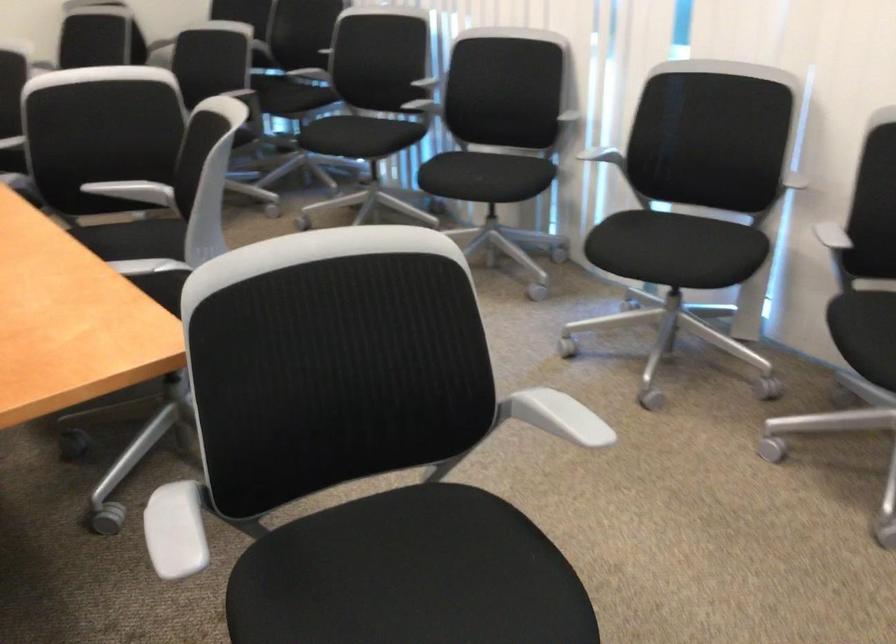
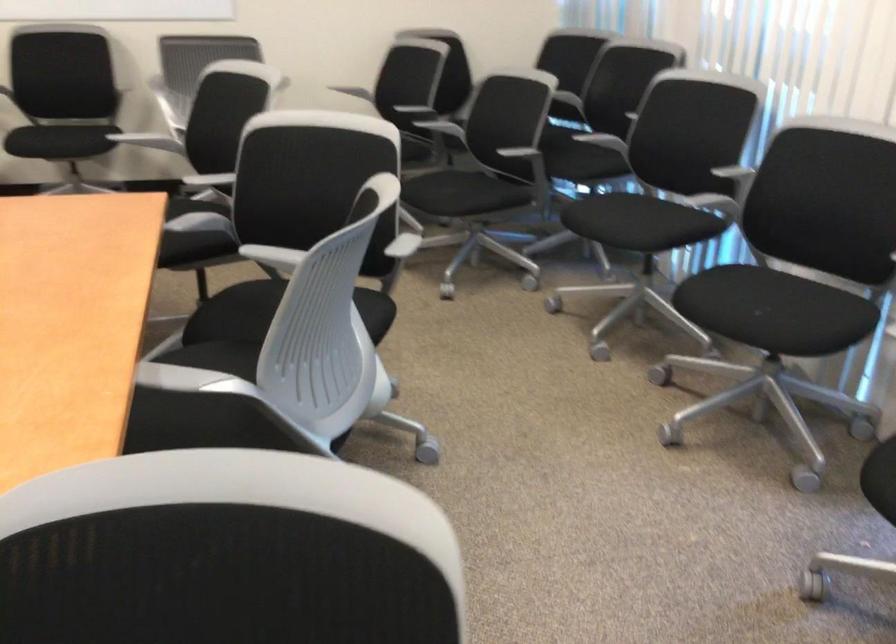
Find the pixel in the second image that matches (x=291, y=91) in the first image.

(588, 147)